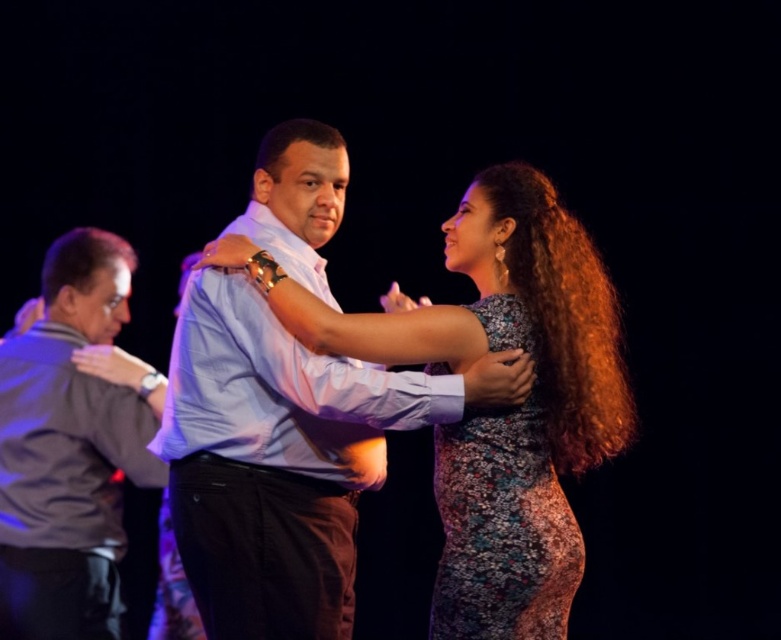
Is point (66, 419) less distant than point (473, 484)?

No, it is not.

Can you confirm if gray fabric shirt at left is shorter than floral lace dress at center?

Incorrect, gray fabric shirt at left's height does not fall short of floral lace dress at center's.

Where is `gray fabric shirt at left`? The height and width of the screenshot is (640, 781). gray fabric shirt at left is located at coordinates (68, 449).

Is floral dress at center to the left of floral lace dress at center from the viewer's perspective?

Correct, you'll find floral dress at center to the left of floral lace dress at center.

Who is lower down, floral dress at center or floral lace dress at center?

Positioned lower is floral lace dress at center.

The height and width of the screenshot is (640, 781). I want to click on floral dress at center, so click(x=500, y=412).

At what (x,y) coordinates should I click in order to perform the action: click on floral dress at center. Please return your answer as a coordinate pair (x, y). Image resolution: width=781 pixels, height=640 pixels. Looking at the image, I should click on (500, 412).

Which of these two, floral dress at center or gray fabric shirt at left, stands shorter?

gray fabric shirt at left

Who is more forward, (569,250) or (50,284)?

Point (569,250) is in front.

Where is `floral dress at center`? floral dress at center is located at coordinates (500, 412).